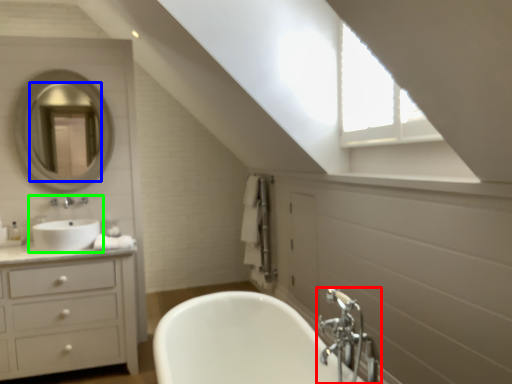
Question: Estimate the real-world distances between objects in this image. Which object is closer to tap (highlighted by a red box), mirror (highlighted by a blue box) or sink (highlighted by a green box)?

Choices:
 (A) mirror
 (B) sink

Answer: (B)